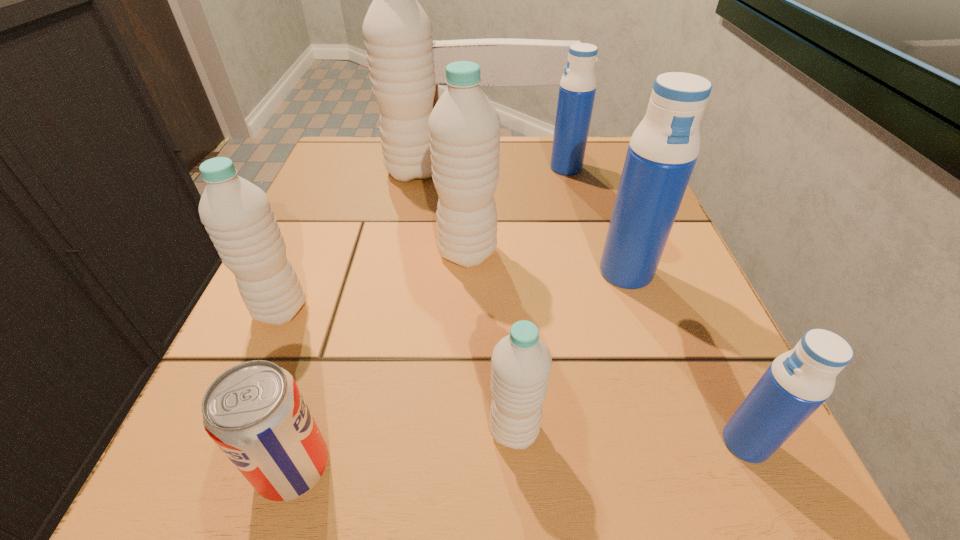
This screenshot has height=540, width=960. I want to click on soda located in the left edge section of the desktop, so click(x=255, y=413).

What are the coordinates of `object that is at the far left corner` in the screenshot? It's located at (397, 31).

The height and width of the screenshot is (540, 960). I want to click on object positioned at the near left corner, so click(x=255, y=413).

At what (x,y) coordinates should I click in order to perform the action: click on object present at the far right corner. Please return your answer as a coordinate pair (x, y). This screenshot has width=960, height=540. Looking at the image, I should click on (577, 89).

Find the location of a particular element. This screenshot has width=960, height=540. object situated at the near right corner is located at coordinates (799, 381).

In the image, there is a desktop. Where is `vacant space at the far edge`? Image resolution: width=960 pixels, height=540 pixels. vacant space at the far edge is located at coordinates (531, 190).

In the image, there is a desktop. Where is `blank space at the near edge`? The height and width of the screenshot is (540, 960). blank space at the near edge is located at coordinates (370, 462).

Find the location of `vacant space at the left edge`. vacant space at the left edge is located at coordinates (310, 223).

At what (x,y) coordinates should I click in order to perform the action: click on free location at the right edge. Please return your answer as a coordinate pair (x, y). Looking at the image, I should click on (646, 332).

This screenshot has width=960, height=540. In order to click on blank space at the far right corner of the desktop in this screenshot , I will do `click(576, 182)`.